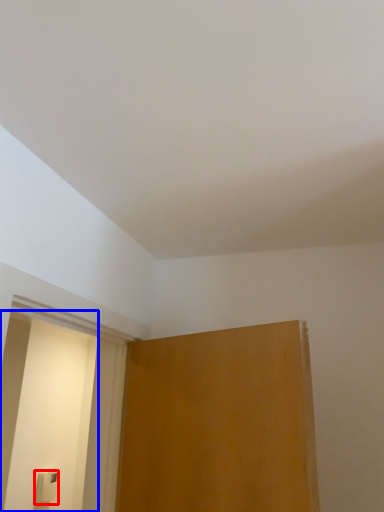
Question: Which point is closer to the camera, light switch (highlighted by a red box) or screen door (highlighted by a blue box)?

Choices:
 (A) light switch
 (B) screen door

Answer: (B)